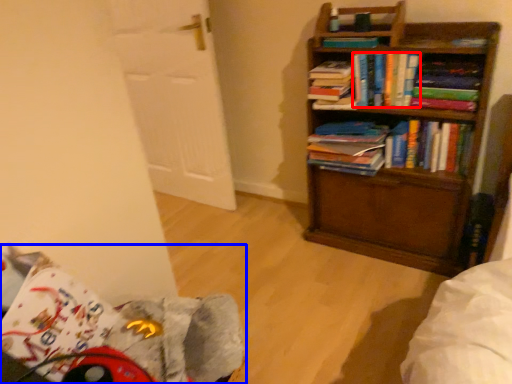
Question: Among these objects, which one is nearest to the camera, book (highlighted by a red box) or swivel chair (highlighted by a blue box)?

Choices:
 (A) book
 (B) swivel chair

Answer: (B)